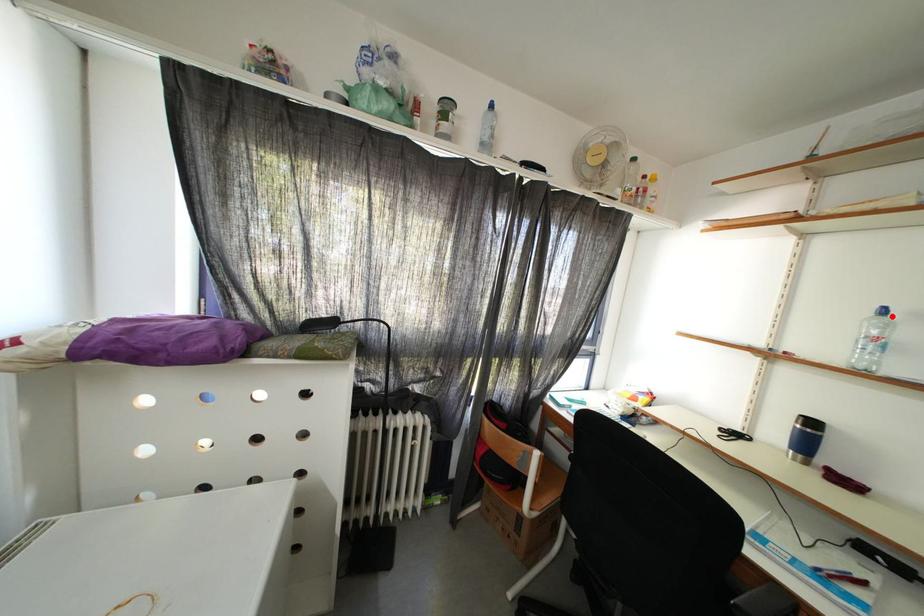
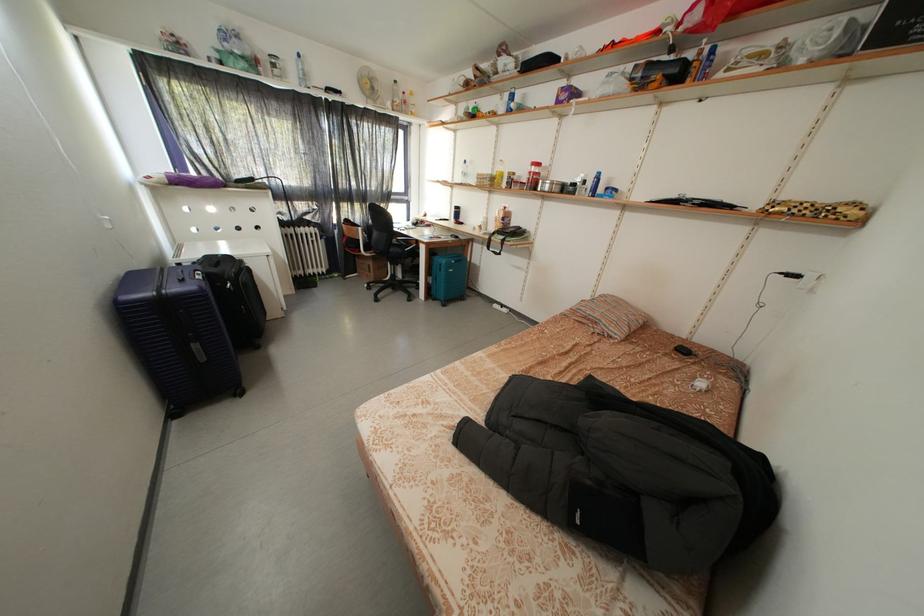
Question: I am providing you with two images of the same scene from different viewpoints. In image1, a red point is highlighted. Considering the same 3D point in image2, which of the following is correct?

Choices:
 (A) It is closer
 (B) It is farther

Answer: (A)